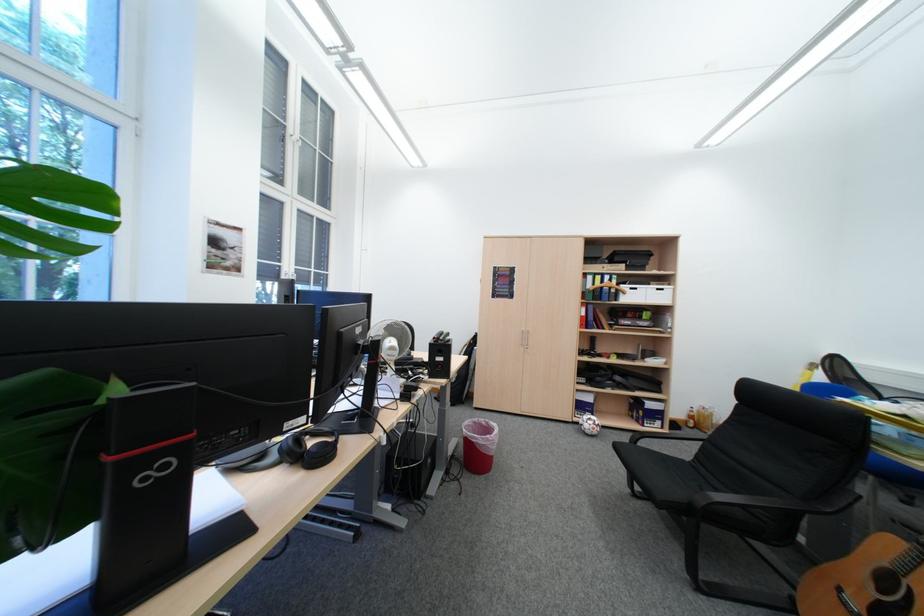
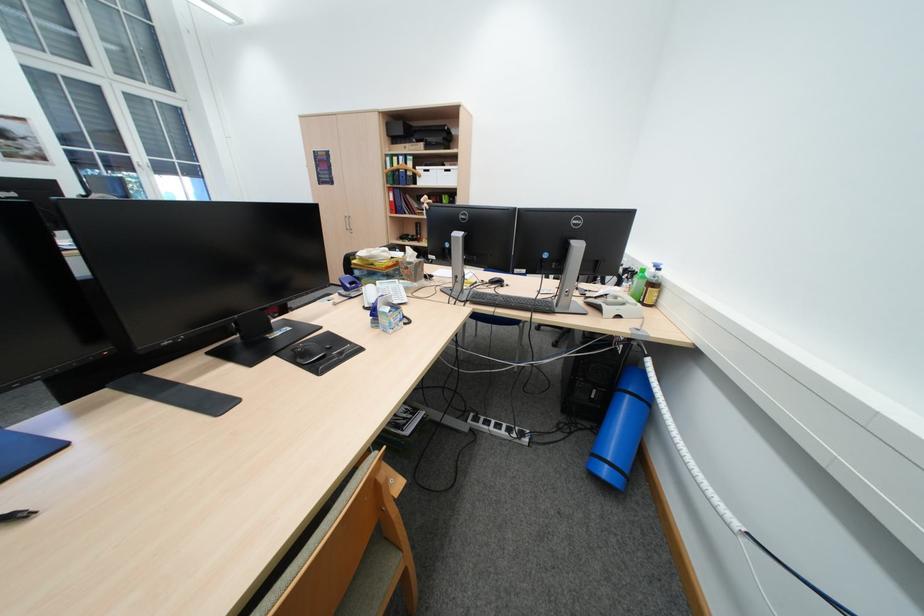
Find the pixel in the second image that matches point 649,297 in the first image.

(442, 179)